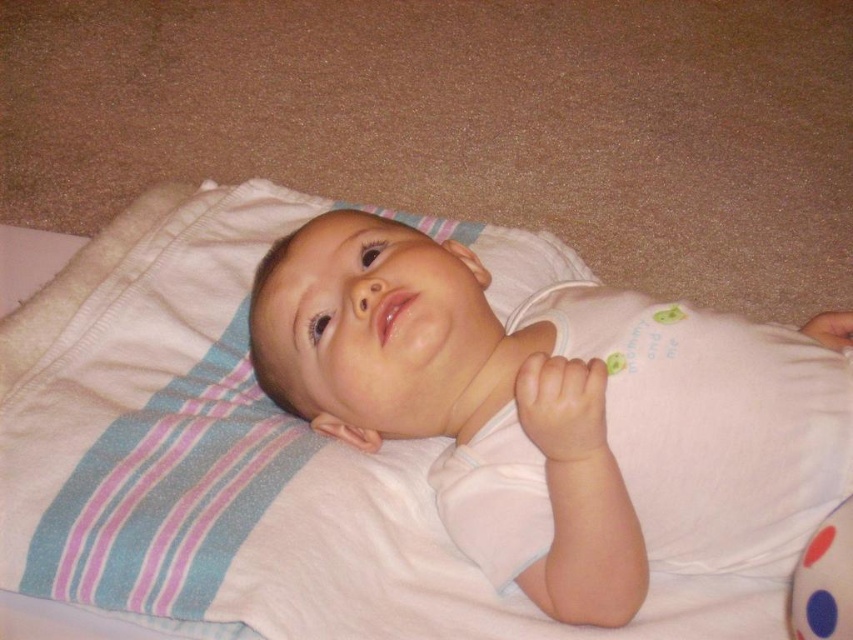
You are a parent holding a 12 inch long toy. You want to place it between the white soft pillow at upper center and the polka dot fabric ball at lower right so that it touches both objects. Is this possible?

The distance between the white soft pillow at upper center and the polka dot fabric ball at lower right is 22.25 inches. Since the toy is only 12 inches long, it cannot span the entire distance to touch both objects.

You are a photographer setting up a shoot for a baby product catalog. You need to ensure that the white soft baby at center is the main focus of the image. Considering the white soft pillow at upper center, which object should you adjust in size to maintain the baby as the focal point?

The white soft pillow at upper center should be made smaller since it is currently larger than the white soft baby at center, which could distract from the baby being the main focus.